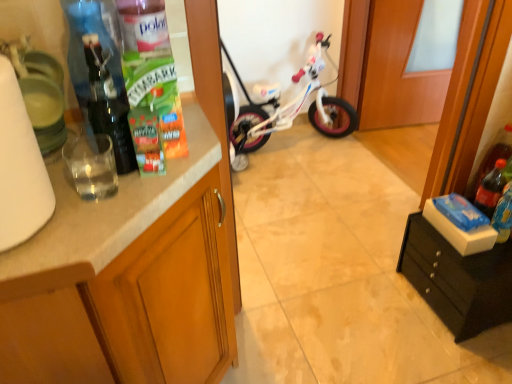
Locate an element on the screen. The image size is (512, 384). vacant space underneath white glossy bicycle at center (from a real-world perspective) is located at coordinates (305, 145).